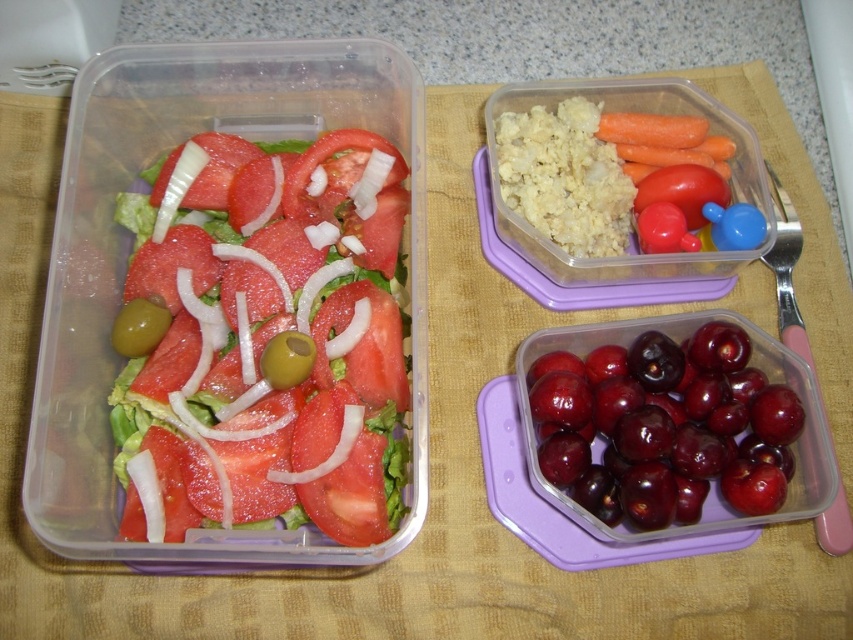
Question: Does shiny red cherries at lower right have a lesser width compared to green matte olive at center?

Choices:
 (A) no
 (B) yes

Answer: (A)

Question: Does shiny red cherries at lower right appear under green matte olive at left?

Choices:
 (A) yes
 (B) no

Answer: (A)

Question: Estimate the real-world distances between objects in this image. Which object is farther from the green matte olive at left?

Choices:
 (A) sliced tomato salad at center
 (B) green matte olive at center
 (C) shiny red cherries at lower right

Answer: (C)

Question: Which object appears farthest from the camera in this image?

Choices:
 (A) shiny red cherries at lower right
 (B) green matte olive at left

Answer: (B)

Question: Which object is the farthest from the green matte olive at left?

Choices:
 (A) shiny red cherries at lower right
 (B) green matte olive at center

Answer: (A)

Question: Is shiny red cherries at lower right positioned in front of green matte olive at left?

Choices:
 (A) yes
 (B) no

Answer: (A)